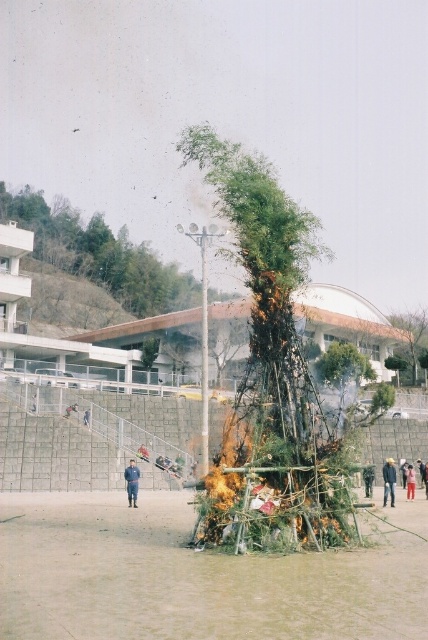
Consider the image. Which is above, blue uniform at center or light brown fabric jacket at lower right?

blue uniform at center

Is blue uniform at center shorter than light brown fabric jacket at lower right?

Incorrect, blue uniform at center's height does not fall short of light brown fabric jacket at lower right's.

Where is `blue uniform at center`? The width and height of the screenshot is (428, 640). blue uniform at center is located at coordinates pyautogui.click(x=131, y=483).

You are a GUI agent. You are given a task and a screenshot of the screen. Output one action in this format:
    pyautogui.click(x=<x>, y=<y>)
    Task: Click on the blue uniform at center
    
    Given the screenshot: What is the action you would take?
    pyautogui.click(x=131, y=483)

Between green bamboo at center and blue uniform at center, which one has less height?

Standing shorter between the two is blue uniform at center.

Who is positioned more to the right, green bamboo at center or blue uniform at center?

green bamboo at center is more to the right.

Does point (412, 358) come in front of point (125, 486)?

No, it is behind (125, 486).

This screenshot has height=640, width=428. I want to click on green bamboo at center, so click(412, 337).

How far apart are burning bamboo at center and bamboo at center?

A distance of 95.84 meters exists between burning bamboo at center and bamboo at center.

Does burning bamboo at center appear on the left side of bamboo at center?

Incorrect, burning bamboo at center is not on the left side of bamboo at center.

Where is `burning bamboo at center`? The width and height of the screenshot is (428, 640). burning bamboo at center is located at coordinates 279,340.